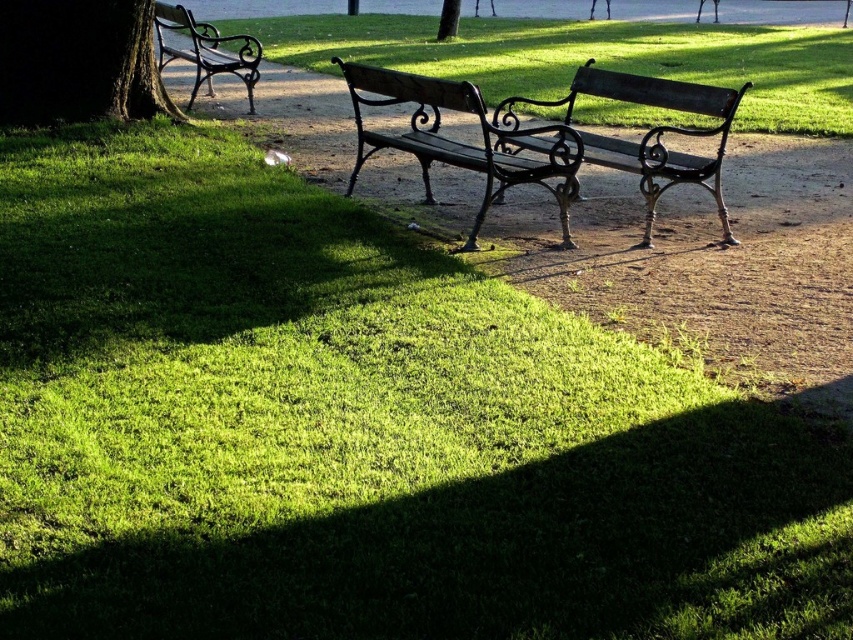
Who is shorter, green grass at center or polished dark wood bench at left?

With less height is polished dark wood bench at left.

Who is more forward, (735, 42) or (219, 42)?

Point (219, 42)

Describe the element at coordinates (589, 58) in the screenshot. The height and width of the screenshot is (640, 853). I see `green grass at center` at that location.

Where is `green grass at center`? green grass at center is located at coordinates (589, 58).

Is green textured tree trunk at left to the left of wooden park bench at center from the viewer's perspective?

Yes, green textured tree trunk at left is to the left of wooden park bench at center.

Does green textured tree trunk at left appear on the right side of wooden park bench at center?

No, green textured tree trunk at left is not to the right of wooden park bench at center.

Where is `green textured tree trunk at left`? Image resolution: width=853 pixels, height=640 pixels. green textured tree trunk at left is located at coordinates (78, 61).

This screenshot has height=640, width=853. I want to click on green textured tree trunk at left, so click(x=78, y=61).

Is point (468, 150) positioned after point (206, 48)?

No.

Can you confirm if wooden park bench at center is smaller than polished dark wood bench at left?

Actually, wooden park bench at center might be larger than polished dark wood bench at left.

Is point (508, 163) closer to viewer compared to point (196, 60)?

Yes.

The image size is (853, 640). Find the location of `wooden park bench at center`. wooden park bench at center is located at coordinates (459, 141).